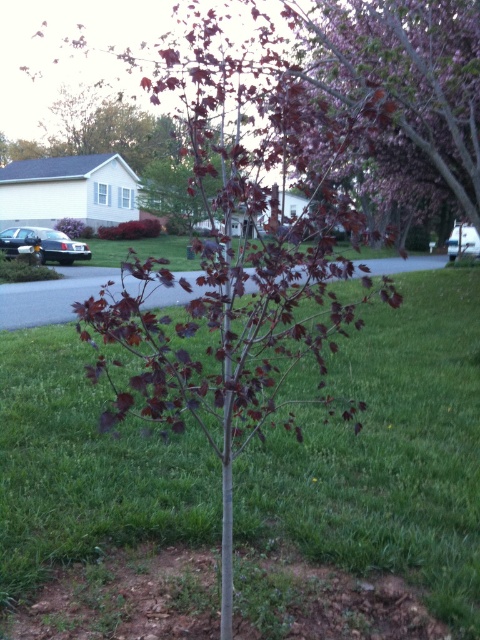
Question: Which object appears farthest from the camera in this image?

Choices:
 (A) purple glossy tree at upper right
 (B) green grass at center

Answer: (A)

Question: Which point is farther to the camera?

Choices:
 (A) (474, 108)
 (B) (46, 566)

Answer: (A)

Question: Is dark purple leafy tree at center to the left of purple glossy tree at upper right from the viewer's perspective?

Choices:
 (A) yes
 (B) no

Answer: (A)

Question: Which point is farther from the camera taking this photo?

Choices:
 (A) (346, 36)
 (B) (1, 472)
 (C) (440, 124)

Answer: (A)

Question: Where is green grass at center located in relation to dark purple leafy tree at center in the image?

Choices:
 (A) above
 (B) below

Answer: (B)

Question: Does dark purple leafy tree at center come in front of purple glossy tree at upper right?

Choices:
 (A) yes
 (B) no

Answer: (A)